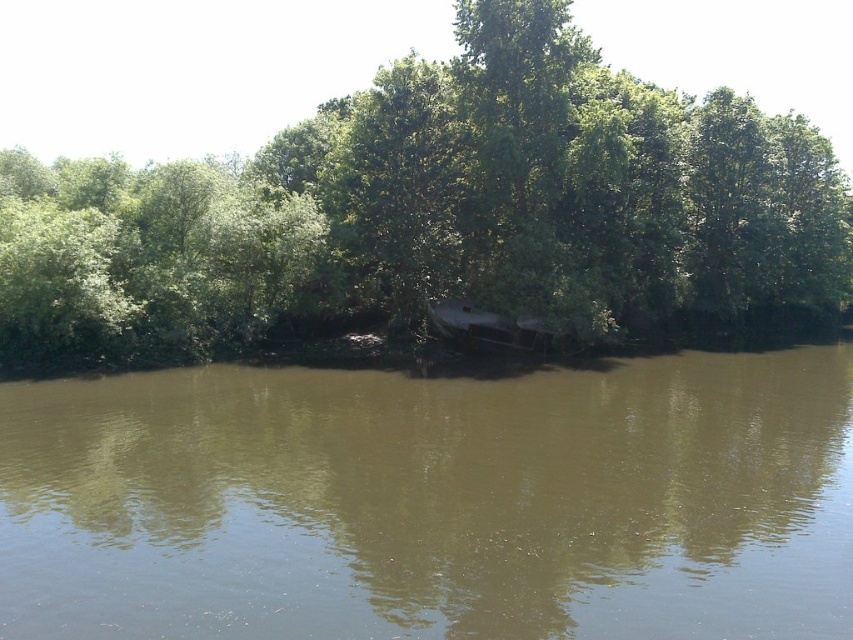
Describe the element at coordinates (433, 502) in the screenshot. I see `brown murky water at center` at that location.

Is brown murky water at center bigger than dark brown wood boat at center?

Indeed, brown murky water at center has a larger size compared to dark brown wood boat at center.

The width and height of the screenshot is (853, 640). In order to click on brown murky water at center in this screenshot , I will do `click(433, 502)`.

Between point (334, 412) and point (201, 337), which one is positioned in front?

Point (334, 412)

How distant is brown murky water at center from green leafy tree at center?

brown murky water at center is 102.87 feet away from green leafy tree at center.

This screenshot has width=853, height=640. Describe the element at coordinates (433, 502) in the screenshot. I see `brown murky water at center` at that location.

Locate an element on the screen. brown murky water at center is located at coordinates (433, 502).

Does green leafy tree at center have a greater width compared to dark brown wood boat at center?

Correct, the width of green leafy tree at center exceeds that of dark brown wood boat at center.

Is green leafy tree at center bigger than dark brown wood boat at center?

Correct, green leafy tree at center is larger in size than dark brown wood boat at center.

Is point (206, 268) behind point (529, 324)?

No, (206, 268) is closer to viewer.

Where is `green leafy tree at center`? green leafy tree at center is located at coordinates (438, 212).